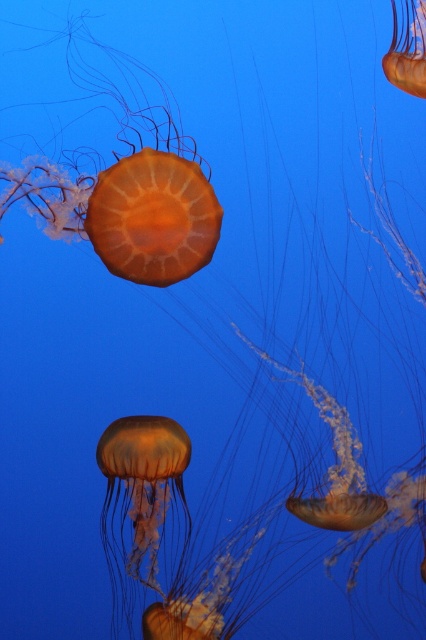
Question: Which point is closer to the camera taking this photo?

Choices:
 (A) (399, 22)
 (B) (143, 481)

Answer: (A)

Question: Is translucent orange jellyfish at center wider than translucent orange jellyfish at upper center?

Choices:
 (A) no
 (B) yes

Answer: (B)

Question: Which point is closer to the camera?

Choices:
 (A) translucent orange jellyfish at upper center
 (B) translucent orange jellyfish at center

Answer: (A)

Question: Is translucent orange jellyfish at center thinner than translucent orange jellyfish at upper center?

Choices:
 (A) no
 (B) yes

Answer: (A)

Question: Can you confirm if translucent orange jellyfish at center is positioned above translucent orange jellyfish at upper center?

Choices:
 (A) yes
 (B) no

Answer: (B)

Question: Which point appears farthest from the camera in this image?

Choices:
 (A) (172, 509)
 (B) (417, 58)

Answer: (A)